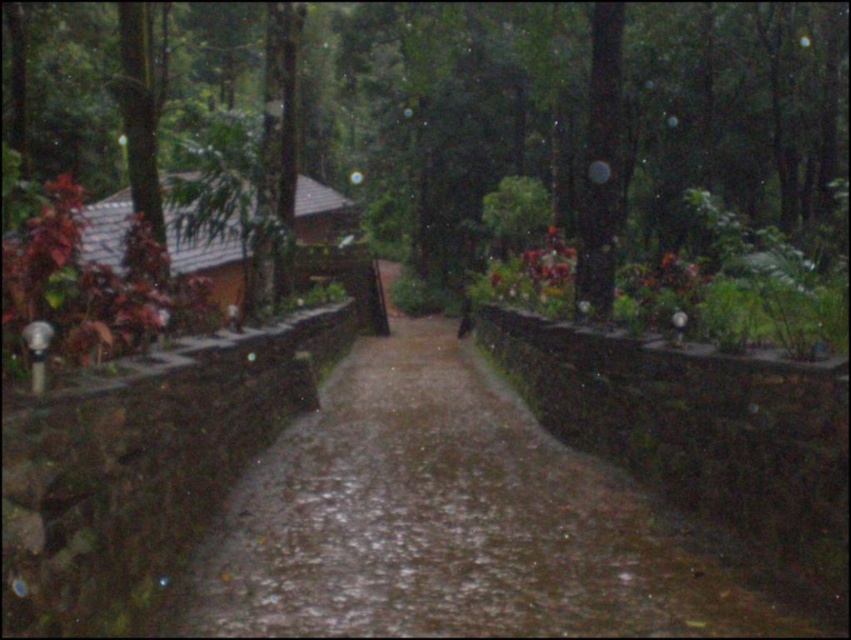
Question: Which of the following is the closest to the observer?

Choices:
 (A) (220, 584)
 (B) (760, 60)
 (C) (610, 157)

Answer: (A)

Question: Based on their relative distances, which object is farther from the green matte tree at center?

Choices:
 (A) green leafy forest at center
 (B) damp concrete path at center

Answer: (A)

Question: Does green leafy forest at center appear under damp concrete path at center?

Choices:
 (A) no
 (B) yes

Answer: (A)

Question: Is green leafy forest at center below green matte tree at center?

Choices:
 (A) no
 (B) yes

Answer: (A)

Question: Which object is closer to the camera taking this photo?

Choices:
 (A) damp concrete path at center
 (B) green matte tree at center

Answer: (A)

Question: In this image, where is green leafy forest at center located relative to damp concrete path at center?

Choices:
 (A) above
 (B) below

Answer: (A)